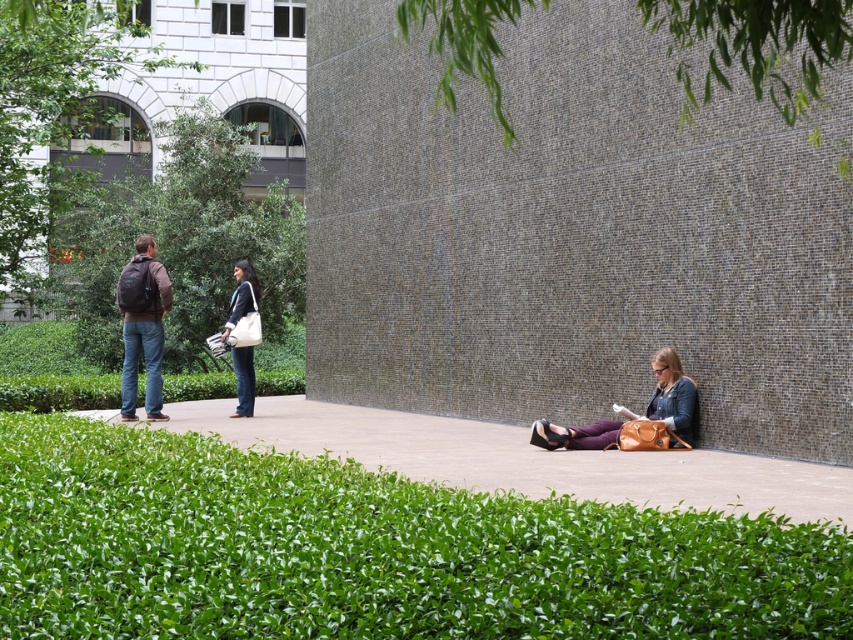
You are a delivery drone operator. Your task is to deliver a package to the person sitting against the wall in the outdoor urban scene. The package must be placed on the ground near the person without hitting the matte black backpack at left. Based on the scene description, can you confirm if there is enough space to safely place the package?

The matte black backpack at left is located at point (x=142, y=326) in 2D space. Since the person is sitting against the wall with their brown handbag beside them, there should be sufficient space on the ground near them to place the package without hitting the backpack, provided the delivery is aimed accurately.

You are a delivery person who needs to place a small package. You have two options in the image, the matte black backpack at left and the white canvas tote bag at center. Which one has enough space to fit the small package?

The matte black backpack at left has a larger size compared to the white canvas tote bag at center, so it has enough space to fit the small package.